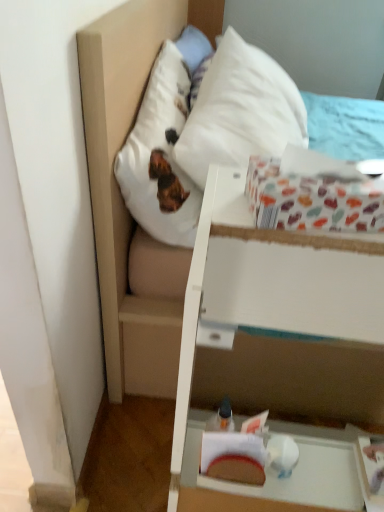
The height and width of the screenshot is (512, 384). Describe the element at coordinates (313, 200) in the screenshot. I see `multicolored paper at upper right` at that location.

Locate an element on the screen. The width and height of the screenshot is (384, 512). multicolored paper at upper right is located at coordinates (313, 200).

Find the location of a particular element. The width and height of the screenshot is (384, 512). white soft pillow at upper center is located at coordinates (240, 111).

Locate an element on the screen. This screenshot has width=384, height=512. white matte vanity at lower right is located at coordinates (277, 351).

Find the location of a particular element. multicolored paper at upper right is located at coordinates (313, 200).

Would you consider multicolored paper at upper right to be distant from white matte vanity at lower right?

They are positioned close to each other.

From a real-world perspective, between multicolored paper at upper right and white matte vanity at lower right, who is vertically higher?

In real-world perspective, multicolored paper at upper right is above.

This screenshot has width=384, height=512. Identify the location of cardboard box that is behind the white matte vanity at lower right. (313, 200).

Looking at their sizes, would you say multicolored paper at upper right is wider or thinner than white matte vanity at lower right?

In the image, multicolored paper at upper right appears to be more narrow than white matte vanity at lower right.

Considering the points (260, 160) and (240, 115), which point is in front, point (260, 160) or point (240, 115)?

The point (260, 160) is in front.

Can you confirm if multicolored paper at upper right is shorter than white soft pillow at upper center?

Yes, multicolored paper at upper right is shorter than white soft pillow at upper center.

Which object is positioned more to the right, multicolored paper at upper right or white soft pillow at upper center?

From the viewer's perspective, white soft pillow at upper center appears more on the right side.

Considering the sizes of objects multicolored paper at upper right and white soft pillow at upper center in the image provided, who is thinner, multicolored paper at upper right or white soft pillow at upper center?

multicolored paper at upper right.

Is white matte vanity at lower right taller or shorter than multicolored paper at upper right?

In the image, white matte vanity at lower right appears to be taller than multicolored paper at upper right.

Between white matte vanity at lower right and multicolored paper at upper right, which one appears on the left side from the viewer's perspective?

multicolored paper at upper right is more to the left.

From the picture: Is white matte vanity at lower right far from multicolored paper at upper right?

Actually, white matte vanity at lower right and multicolored paper at upper right are a little close together.

Does point (317, 298) come farther from viewer compared to point (338, 183)?

Yes.

Considering the positions of point (262, 105) and point (319, 212), is point (262, 105) closer or farther from the camera than point (319, 212)?

Point (262, 105).

Image resolution: width=384 pixels, height=512 pixels. Find the location of `cardboard box that appears below the white soft pillow at upper center (from the image's perspective)`. cardboard box that appears below the white soft pillow at upper center (from the image's perspective) is located at coordinates (313, 200).

From the image's perspective, is white soft pillow at upper center located beneath multicolored paper at upper right?

No, from the image's perspective, white soft pillow at upper center is not below multicolored paper at upper right.

From a real-world perspective, is white matte vanity at lower right on white soft pillow at upper center?

Actually, white matte vanity at lower right is physically below white soft pillow at upper center in the real world.

In terms of height, does white matte vanity at lower right look taller or shorter compared to white soft pillow at upper center?

Clearly, white matte vanity at lower right is taller compared to white soft pillow at upper center.

From the image's perspective, between white matte vanity at lower right and white soft pillow at upper center, who is located below?

From the image's view, white matte vanity at lower right is below.

Based on their positions, is white matte vanity at lower right located to the left or right of white soft pillow at upper center?

white matte vanity at lower right is to the right of white soft pillow at upper center.

From a real-world perspective, who is located higher, white soft pillow at upper center or white matte vanity at lower right?

From a 3D spatial view, white soft pillow at upper center is above.

From the image's perspective, would you say white soft pillow at upper center is positioned over white matte vanity at lower right?

Yes, from the image's perspective, white soft pillow at upper center is above white matte vanity at lower right.

Relative to white matte vanity at lower right, is white soft pillow at upper center in front or behind?

In the image, white soft pillow at upper center appears behind white matte vanity at lower right.

Between white soft pillow at upper center and white matte vanity at lower right, which one has smaller width?

With smaller width is white matte vanity at lower right.

This screenshot has height=512, width=384. In order to click on cardboard box above the white matte vanity at lower right (from the image's perspective) in this screenshot , I will do `click(313, 200)`.

The width and height of the screenshot is (384, 512). I want to click on cardboard box above the white soft pillow at upper center (from a real-world perspective), so click(x=313, y=200).

Estimate the real-world distances between objects in this image. Which object is closer to multicolored paper at upper right, white soft pillow at upper center or white matte vanity at lower right?

white matte vanity at lower right is positioned closer to the anchor multicolored paper at upper right.

Considering their positions, is white matte vanity at lower right positioned closer to white soft pillow at upper center than multicolored paper at upper right?

The object closer to white soft pillow at upper center is multicolored paper at upper right.

From the image, which object appears to be farther from white matte vanity at lower right, white soft pillow at upper center or multicolored paper at upper right?

The object further to white matte vanity at lower right is white soft pillow at upper center.

From the image, which object appears to be farther from white soft pillow at upper center, multicolored paper at upper right or white matte vanity at lower right?

white matte vanity at lower right.

When comparing their distances from white matte vanity at lower right, does multicolored paper at upper right or white soft pillow at upper center seem closer?

multicolored paper at upper right is positioned closer to the anchor white matte vanity at lower right.

Which object lies further to the anchor point multicolored paper at upper right, white matte vanity at lower right or white soft pillow at upper center?

white soft pillow at upper center is positioned further to the anchor multicolored paper at upper right.

At what (x,y) coordinates should I click in order to perform the action: click on cardboard box between white soft pillow at upper center and white matte vanity at lower right in the vertical direction. Please return your answer as a coordinate pair (x, y). This screenshot has height=512, width=384. Looking at the image, I should click on pos(313,200).